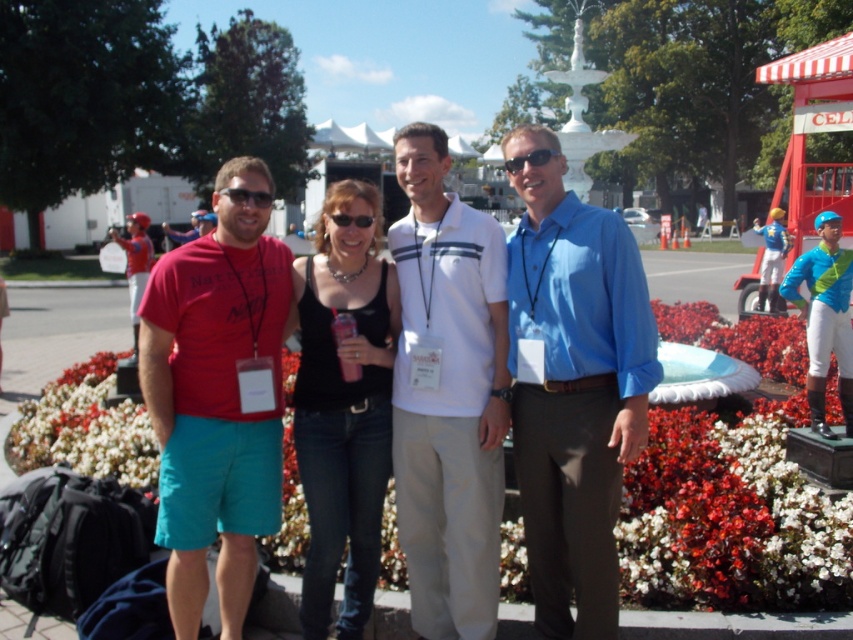
Between white cotton polo shirt at center and black plastic goggles at center, which one appears on the left side from the viewer's perspective?

From the viewer's perspective, black plastic goggles at center appears more on the left side.

Does point (427, 493) come closer to viewer compared to point (332, 218)?

That is False.

Image resolution: width=853 pixels, height=640 pixels. Find the location of `white cotton polo shirt at center`. white cotton polo shirt at center is located at coordinates (447, 394).

Describe the element at coordinates (218, 397) in the screenshot. I see `matte red t-shirt at left` at that location.

Does matte red t-shirt at left appear over matte black sunglasses at center?

Actually, matte red t-shirt at left is below matte black sunglasses at center.

The image size is (853, 640). I want to click on matte red t-shirt at left, so click(x=218, y=397).

Is blue cotton shirt at center wider than matte red t-shirt at left?

In fact, blue cotton shirt at center might be narrower than matte red t-shirt at left.

Is blue cotton shirt at center closer to camera compared to matte red t-shirt at left?

Yes, it is.

Measure the distance between point [541,433] and camera.

3.53 meters

At what (x,y) coordinates should I click in order to perform the action: click on blue cotton shirt at center. Please return your answer as a coordinate pair (x, y). The image size is (853, 640). Looking at the image, I should click on (575, 394).